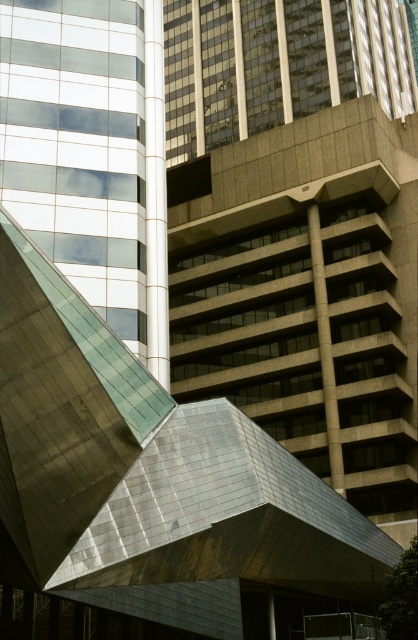
Is matte gray building at center taller than metallic glass building at left?

Yes.

Describe the element at coordinates (300, 230) in the screenshot. I see `matte gray building at center` at that location.

Between point (379, 154) and point (12, 134), which one is positioned in front?

Point (12, 134) is more forward.

The height and width of the screenshot is (640, 418). In order to click on matte gray building at center in this screenshot , I will do `click(300, 230)`.